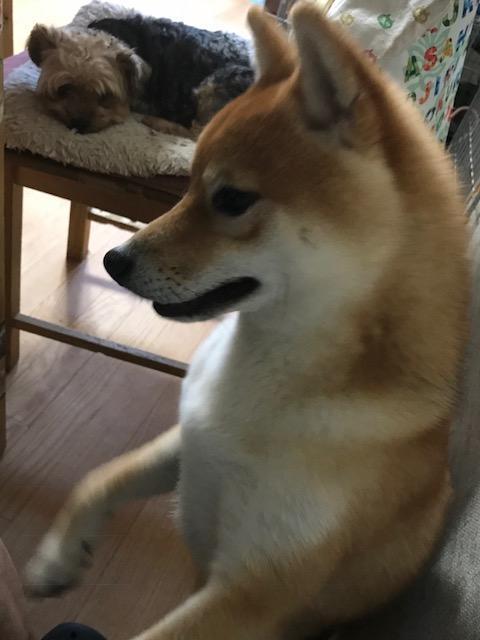
Where is `chair leg`? This screenshot has height=640, width=480. chair leg is located at coordinates (10, 298), (77, 240).